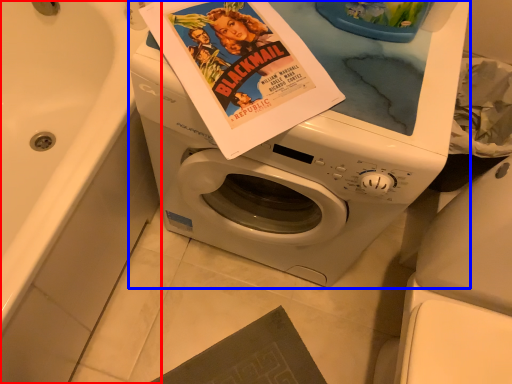
Question: Which object is further to the camera taking this photo, bath (highlighted by a red box) or washing machine (highlighted by a blue box)?

Choices:
 (A) bath
 (B) washing machine

Answer: (B)